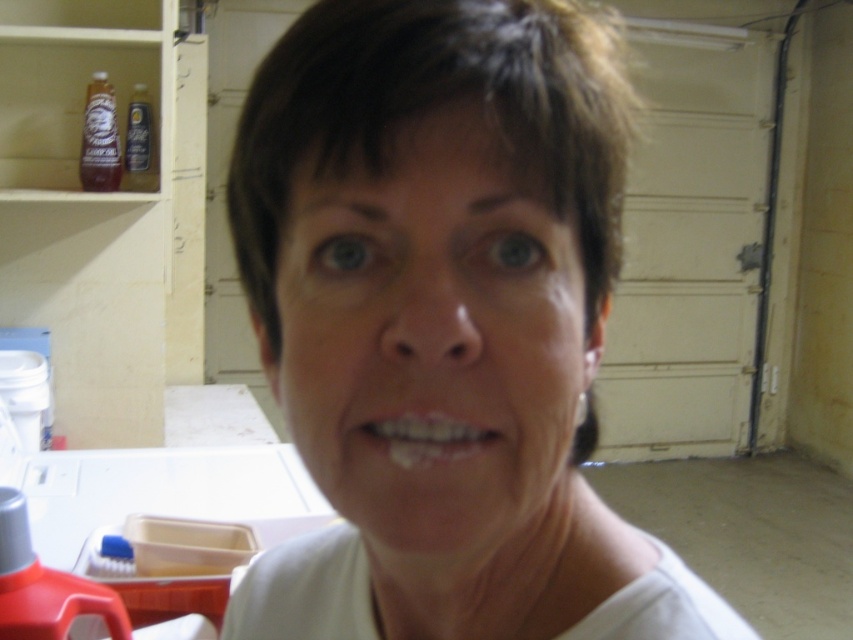
You are a photographer adjusting your camera settings to focus on the person in the image. The focus point is set to coordinates point (444, 323). Based on the scene description, what part of the person is the camera focusing on?

The point (444, 323) corresponds to the white matte shirt at center, so the camera is focusing on the white matte shirt at center.

Based on the scene description, where is the white matte shirt at center located in terms of coordinates?

The white matte shirt at center is located at coordinates point [444,323].

You are a photographer adjusting the lighting in a studio. You notice the white matte shirt at center and the white glossy teeth at center in your subject. Which object should you adjust the lighting for to reduce glare, and why?

You should adjust the lighting for the white glossy teeth at center because glossy surfaces tend to reflect light more, causing glare, whereas matte surfaces like the white matte shirt at center absorb light and reduce reflections.